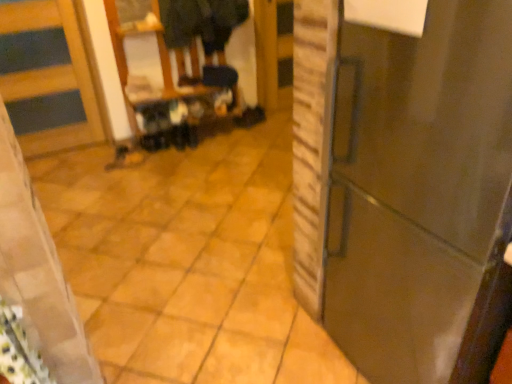
Question: Can you confirm if glossy dark brown door at right, positioned as the second door in left-to-right order, is smaller than matte black shoe at center?

Choices:
 (A) no
 (B) yes

Answer: (A)

Question: Considering the relative positions of glossy dark brown door at right, positioned as the second door in left-to-right order, and matte black shoe at center in the image provided, is glossy dark brown door at right, positioned as the second door in left-to-right order, in front of matte black shoe at center?

Choices:
 (A) no
 (B) yes

Answer: (B)

Question: Is glossy dark brown door at right, which is counted as the first door, starting from the front, oriented towards matte black shoe at center?

Choices:
 (A) yes
 (B) no

Answer: (B)

Question: From the image's perspective, is glossy dark brown door at right, acting as the 2th door starting from the back, located beneath matte black shoe at center?

Choices:
 (A) yes
 (B) no

Answer: (A)

Question: Does glossy dark brown door at right, positioned as the second door in left-to-right order, contain matte black shoe at center?

Choices:
 (A) yes
 (B) no

Answer: (B)

Question: Is wooden door at left, acting as the second door starting from the right, in front of or behind glossy dark brown door at right, positioned as the second door in left-to-right order, in the image?

Choices:
 (A) behind
 (B) front

Answer: (A)

Question: In terms of height, does wooden door at left, which is counted as the second door, starting from the front, look taller or shorter compared to glossy dark brown door at right, placed as the 1th door when sorted from right to left?

Choices:
 (A) tall
 (B) short

Answer: (B)

Question: Considering the positions of wooden door at left, which is counted as the second door, starting from the front, and glossy dark brown door at right, which is counted as the first door, starting from the front, in the image, is wooden door at left, which is counted as the second door, starting from the front, wider or thinner than glossy dark brown door at right, which is counted as the first door, starting from the front,?

Choices:
 (A) wide
 (B) thin

Answer: (B)

Question: From a real-world perspective, is wooden door at left, the first door positioned from the left, above or below glossy dark brown door at right, acting as the 2th door starting from the back?

Choices:
 (A) below
 (B) above

Answer: (A)

Question: Considering the positions of dark fabric coat at upper center and matte black step stool at center in the image, is dark fabric coat at upper center wider or thinner than matte black step stool at center?

Choices:
 (A) thin
 (B) wide

Answer: (B)

Question: Which is correct: dark fabric coat at upper center is inside matte black step stool at center, or outside of it?

Choices:
 (A) inside
 (B) outside

Answer: (B)

Question: Considering the positions of point (179, 72) and point (209, 71), is point (179, 72) closer or farther from the camera than point (209, 71)?

Choices:
 (A) closer
 (B) farther

Answer: (B)

Question: Visually, is dark fabric coat at upper center positioned to the left or to the right of matte black step stool at center?

Choices:
 (A) left
 (B) right

Answer: (A)

Question: Visually, is matte black shoe at center positioned to the left or to the right of glossy dark brown door at right, acting as the 2th door starting from the back?

Choices:
 (A) right
 (B) left

Answer: (B)

Question: From the image's perspective, is matte black shoe at center located above or below glossy dark brown door at right, acting as the 2th door starting from the back?

Choices:
 (A) below
 (B) above

Answer: (B)